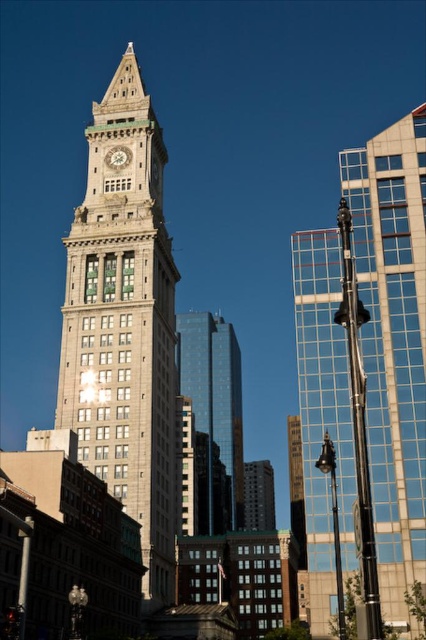
You are standing at the base of the historic clock tower and want to take a photo. There are two points marked on your camera screen at coordinates point (x=354, y=248) and point (x=233, y=502). Which point is closer to you?

Point (x=354, y=248) is in front of point (x=233, y=502), so it is closer to you.

You are a photographer standing in front of the historic clock tower. You want to take a photo that includes both the shiny glass skyscraper at center and the matte gray clock at center. Based on their positions, which object should you adjust your camera to focus on first to ensure both are in the frame?

The shiny glass skyscraper at center is positioned on the right side of matte gray clock at center, so you should focus on the matte gray clock at center first to ensure both are in the frame.

You are a photographer planning to capture the historic clock tower against the backdrop of modern architecture. You notice the shiny glass skyscraper at center and the matte gray clock at center. Which object should you focus on to emphasize vertical dominance in your composition?

The shiny glass skyscraper at center is taller than the matte gray clock at center, so focusing on it would better emphasize vertical dominance in the composition.